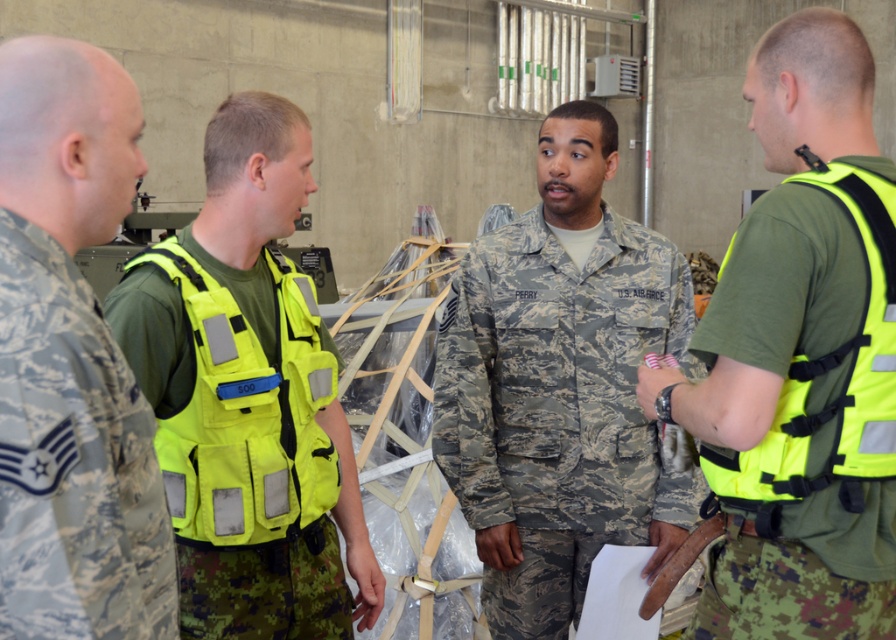
Who is more forward, (4, 451) or (889, 212)?

Positioned in front is point (4, 451).

Which is behind, point (154, 528) or point (851, 212)?

Positioned behind is point (851, 212).

The height and width of the screenshot is (640, 896). Find the location of `camouflage uniform at left`. camouflage uniform at left is located at coordinates point(71,360).

Is point (22, 292) farther from viewer compared to point (306, 422)?

No, it is in front of (306, 422).

Where is `camouflage uniform at left`? The width and height of the screenshot is (896, 640). camouflage uniform at left is located at coordinates (71, 360).

This screenshot has height=640, width=896. What do you see at coordinates (71, 360) in the screenshot?
I see `camouflage uniform at left` at bounding box center [71, 360].

Locate an element on the screen. camouflage uniform at left is located at coordinates (71, 360).

Which is behind, point (857, 221) or point (289, 483)?

The point (289, 483) is more distant.

Can you confirm if neon yellow vest at right is thinner than neon yellow fabric safety vest at center?

No, neon yellow vest at right is not thinner than neon yellow fabric safety vest at center.

Is point (757, 611) less distant than point (205, 417)?

Yes, point (757, 611) is closer to viewer.

Where is `neon yellow vest at right`? The height and width of the screenshot is (640, 896). neon yellow vest at right is located at coordinates (800, 358).